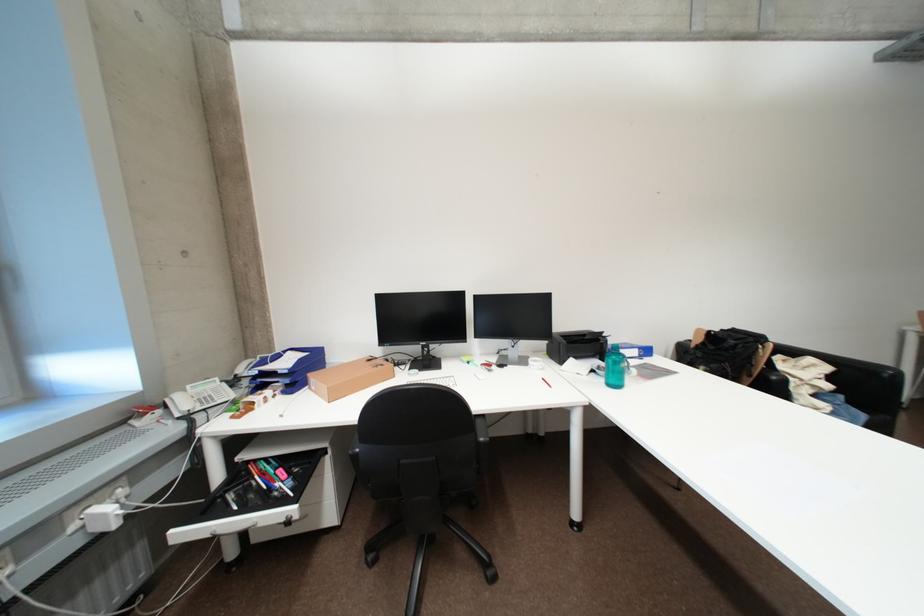
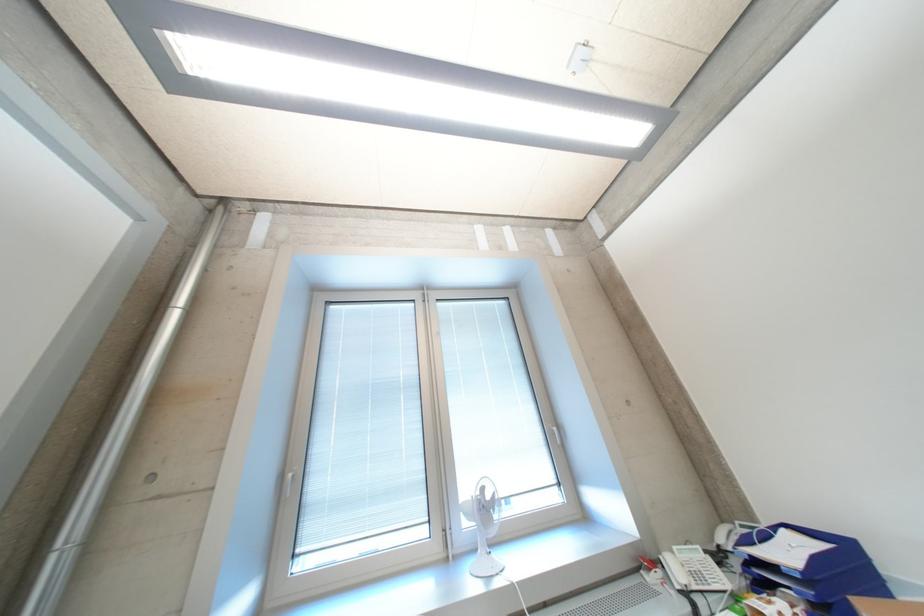
The point at (x=271, y=365) is marked in the first image. Where is the corresponding point in the second image?

(757, 543)